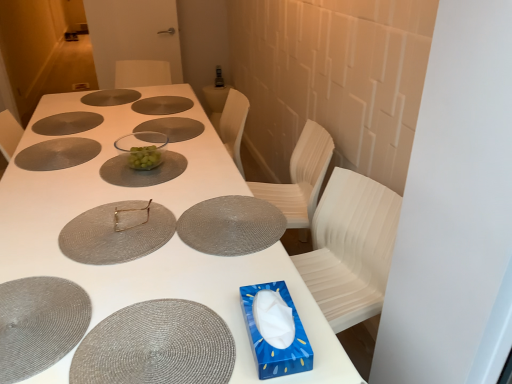
This screenshot has width=512, height=384. I want to click on free space to the back side of matte silver fork at center, so click(x=132, y=184).